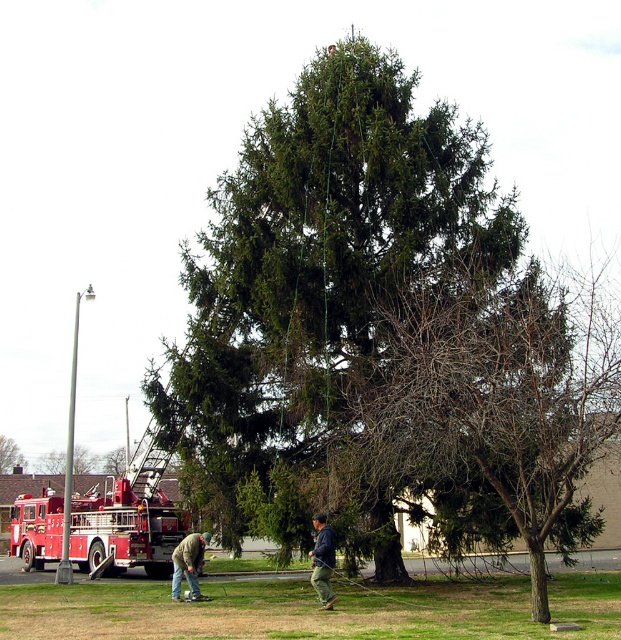
You are a firefighter who needs to park the brushed metal fire truck at lower left near the green matte tree at center. Considering their sizes, will the truck block the tree from view when parked directly in front of it?

The brushed metal fire truck at lower left is much taller than the green matte tree at center, so parking it directly in front would block the tree from view because the truck is taller.